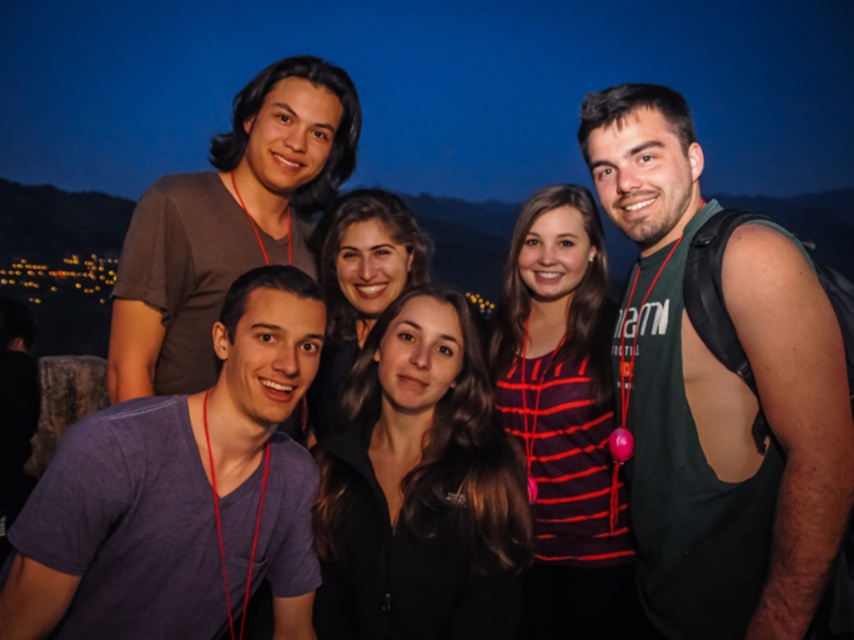
Is point (782, 355) positioned after point (235, 436)?

No.

Which is in front, point (803, 417) or point (136, 584)?

Point (803, 417) is more forward.

The image size is (854, 640). Find the location of `green sleeveless shirt at right`. green sleeveless shirt at right is located at coordinates (720, 394).

Which of these two, green sleeveless shirt at right or brown matte shirt at upper left, stands shorter?

brown matte shirt at upper left is shorter.

Describe the element at coordinates (720, 394) in the screenshot. Image resolution: width=854 pixels, height=640 pixels. I see `green sleeveless shirt at right` at that location.

Locate an element on the screen. Image resolution: width=854 pixels, height=640 pixels. green sleeveless shirt at right is located at coordinates (720, 394).

Can you confirm if purple cotton t-shirt at lower left is thinner than brown matte shirt at upper left?

Yes.

Who is more forward, (173,413) or (227,161)?

Point (173,413) is in front.

Image resolution: width=854 pixels, height=640 pixels. What do you see at coordinates (182, 492) in the screenshot?
I see `purple cotton t-shirt at lower left` at bounding box center [182, 492].

Identify the location of purple cotton t-shirt at lower left. (182, 492).